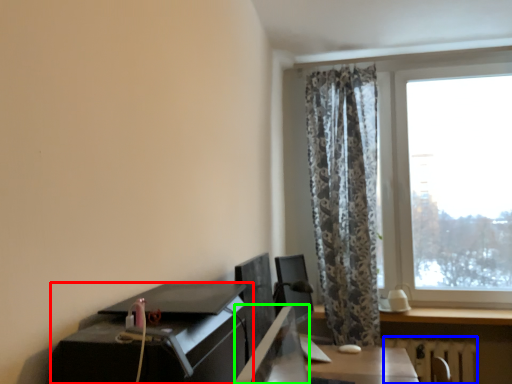
Question: Which object is positioned closest to desk (highlighted by a red box)? Select from radiator (highlighted by a blue box) and desktop (highlighted by a green box).

Choices:
 (A) radiator
 (B) desktop

Answer: (B)